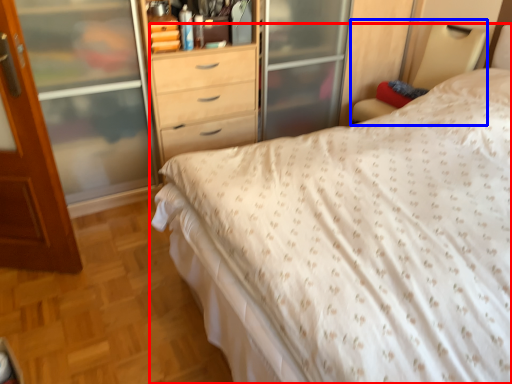
Question: Which object appears farthest to the camera in this image, bed (highlighted by a red box) or bed frame (highlighted by a blue box)?

Choices:
 (A) bed
 (B) bed frame

Answer: (B)